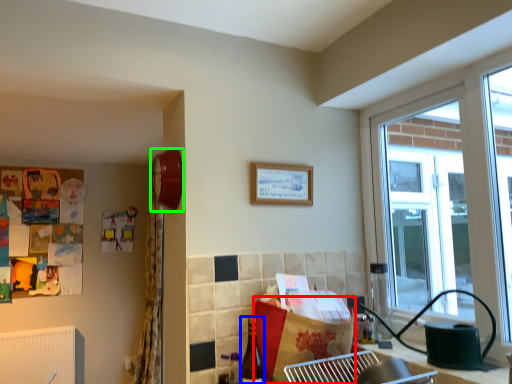
Question: Based on their relative distances, which object is farther from cardboard box (highlighted by a red box)? Choose from bottle (highlighted by a blue box) and clock (highlighted by a green box).

Choices:
 (A) bottle
 (B) clock

Answer: (B)